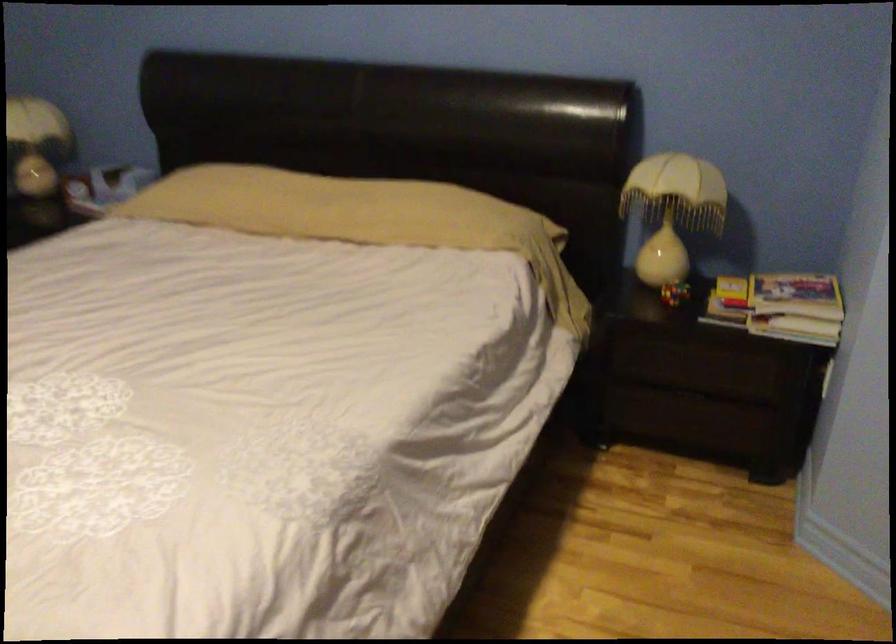
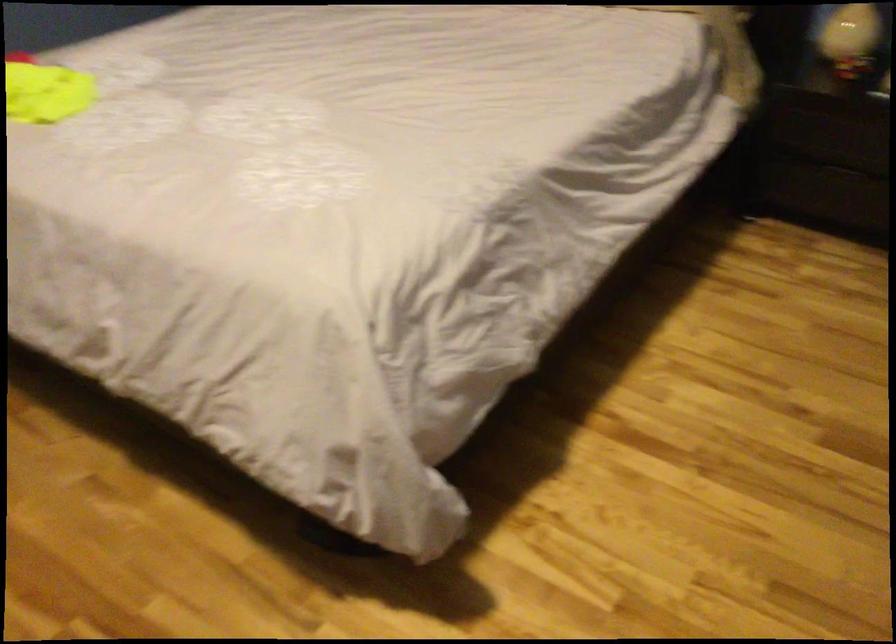
Question: The images are taken continuously from a first-person perspective. In which direction are you moving?

Choices:
 (A) Left
 (B) Right
 (C) Forward
 (D) Backward

Answer: (D)